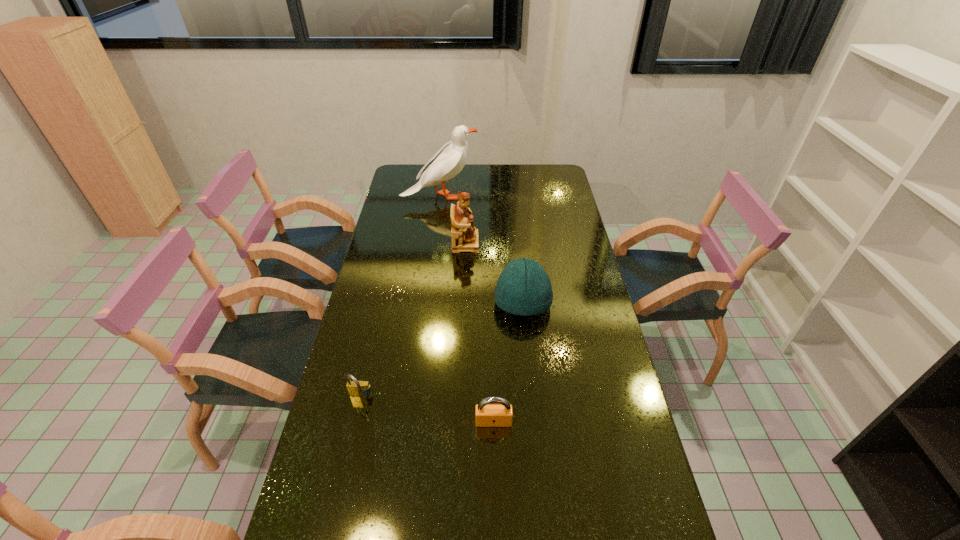
Locate an element on the screen. This screenshot has height=540, width=960. vacant space located at the beak of the gull is located at coordinates (491, 196).

Locate an element on the screen. free space located 0.220m on the front-facing side of the second tallest object is located at coordinates (533, 243).

Locate an element on the screen. The height and width of the screenshot is (540, 960). free location located 0.280m on the left of the third tallest object is located at coordinates (414, 302).

Locate an element on the screen. Image resolution: width=960 pixels, height=540 pixels. vacant space located 0.060m to unlock the nearer padlock from the front is located at coordinates (494, 449).

You are a GUI agent. You are given a task and a screenshot of the screen. Output one action in this format:
    pyautogui.click(x=<x>, y=<y>)
    Task: Click on the vacant space located 0.250m on the side with the combination dials of the left padlock
    
    Given the screenshot: What is the action you would take?
    pyautogui.click(x=338, y=496)

The height and width of the screenshot is (540, 960). I want to click on object located in the far edge section of the desktop, so click(x=450, y=159).

Find the location of a particular element. The image size is (960, 540). gull located at the left edge is located at coordinates (450, 159).

You are a GUI agent. You are given a task and a screenshot of the screen. Output one action in this format:
    pyautogui.click(x=<x>, y=<y>)
    Task: Click on the padlock at the left edge
    The height and width of the screenshot is (540, 960).
    Given the screenshot: What is the action you would take?
    pyautogui.click(x=356, y=388)

At what (x,y) coordinates should I click in order to perform the action: click on object situated at the far left corner. Please return your answer as a coordinate pair (x, y). Looking at the image, I should click on (450, 159).

Find the location of a particular element. This screenshot has width=960, height=540. vacant region at the far edge of the desktop is located at coordinates click(451, 181).